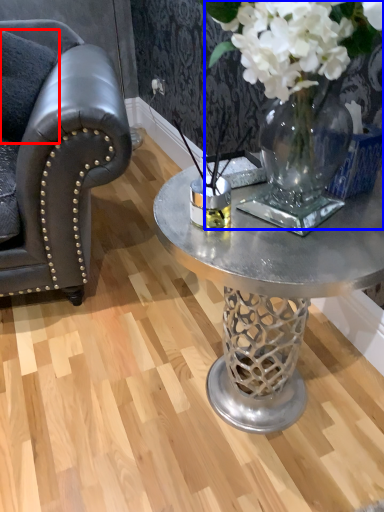
Question: Which of the following is the farthest to the observer, dark (highlighted by a red box) or floral arrangement (highlighted by a blue box)?

Choices:
 (A) dark
 (B) floral arrangement

Answer: (A)